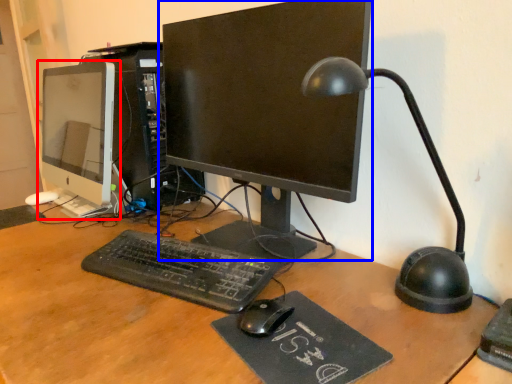
Question: Which point is further to the camera, computer monitor (highlighted by a red box) or computer monitor (highlighted by a blue box)?

Choices:
 (A) computer monitor
 (B) computer monitor

Answer: (A)